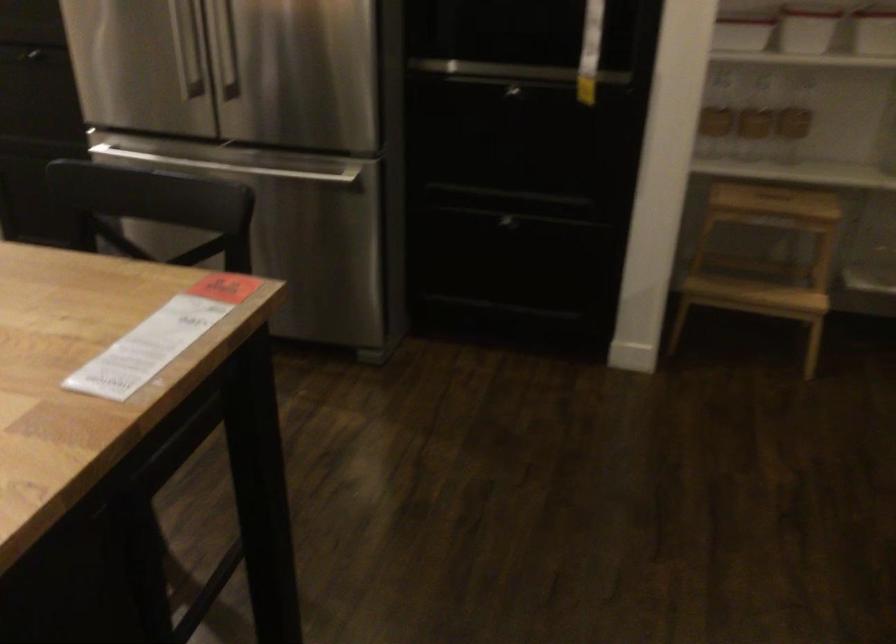
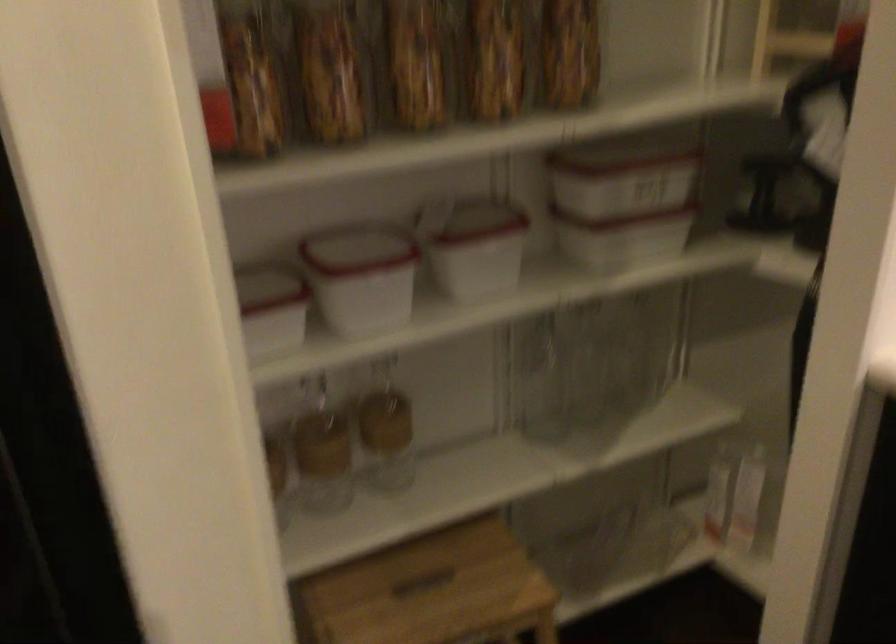
In the second image, find the point that corresponds to (805,113) in the first image.

(385, 430)